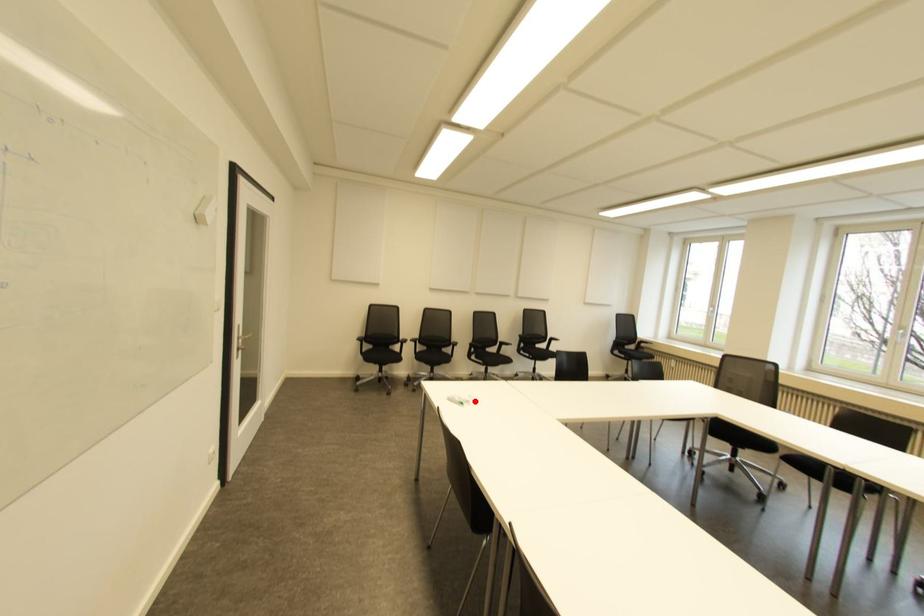
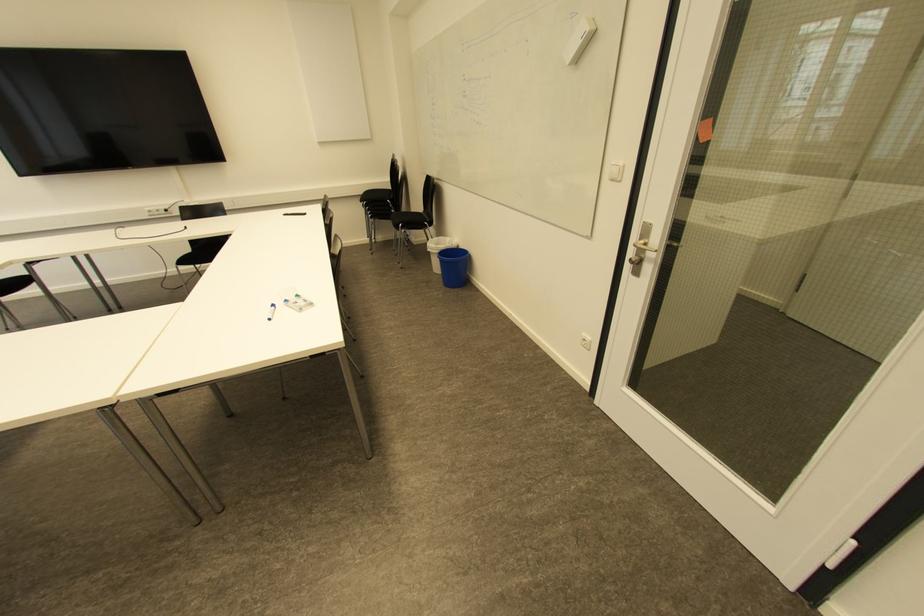
Question: I am providing you with two images of the same scene from different viewpoints. Image1 has a red point marked. In image2, the corresponding 3D location appears at what relative position? Reply with the corresponding letter.

Choices:
 (A) Closer
 (B) Farther

Answer: (B)